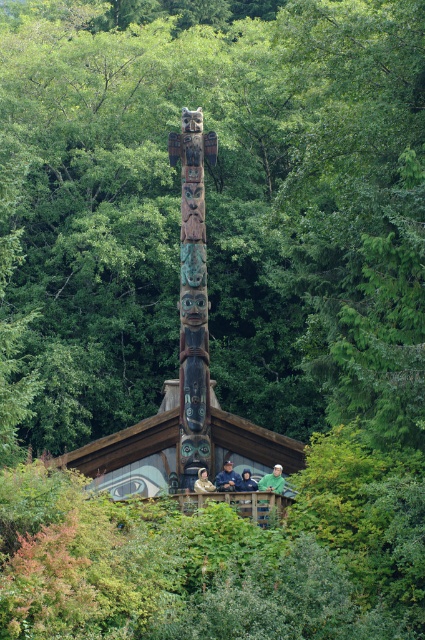
Question: Which is nearer to the wooden hut at center?

Choices:
 (A) green matte shirt at center
 (B) dark green fabric jacket at center
 (C) light brown wooden person at center

Answer: (B)

Question: Which of the following is the closest to the observer?

Choices:
 (A) green matte shirt at center
 (B) carved wooden totem pole at center
 (C) green fabric shirt at center
 (D) wooden hut at center

Answer: (D)

Question: In this image, where is wooden hut at center located relative to carved wooden totem pole at center?

Choices:
 (A) left
 (B) right

Answer: (B)

Question: Observing the image, what is the correct spatial positioning of carved wooden totem pole at center in reference to green matte shirt at center?

Choices:
 (A) below
 (B) above

Answer: (B)

Question: Can you confirm if green fabric shirt at center is smaller than dark green fabric jacket at center?

Choices:
 (A) no
 (B) yes

Answer: (A)

Question: Estimate the real-world distances between objects in this image. Which object is closer to the wooden hut at center?

Choices:
 (A) green fabric shirt at center
 (B) light brown wooden person at center
 (C) green matte shirt at center
 (D) carved wooden totem pole at center

Answer: (A)